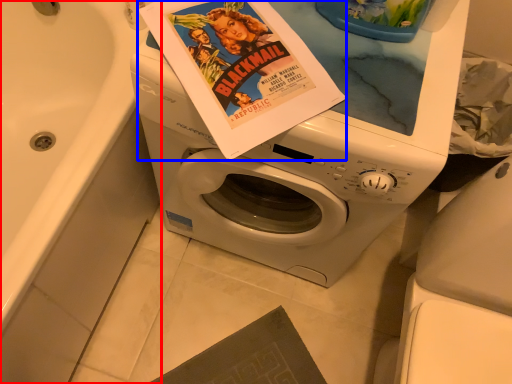
Question: Which object is closer to the camera taking this photo, bath (highlighted by a red box) or paperback book (highlighted by a blue box)?

Choices:
 (A) bath
 (B) paperback book

Answer: (A)